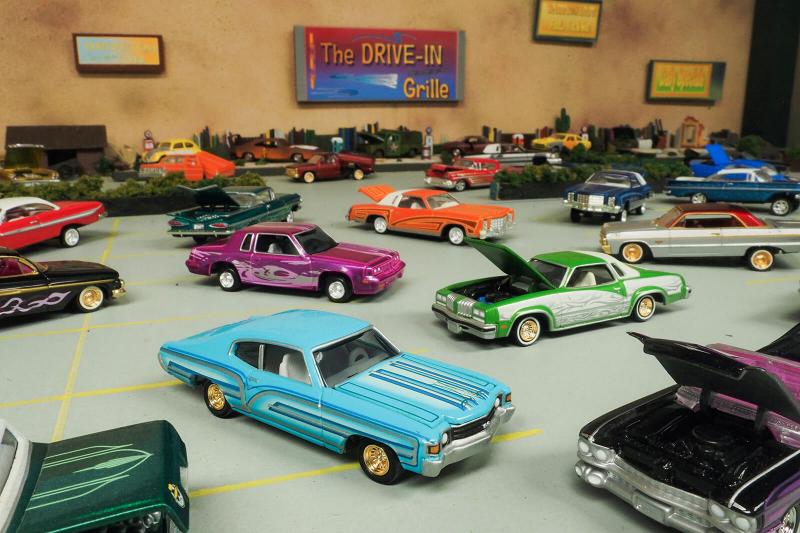
In order to click on brown wall in this screenshot , I will do `click(514, 84)`.